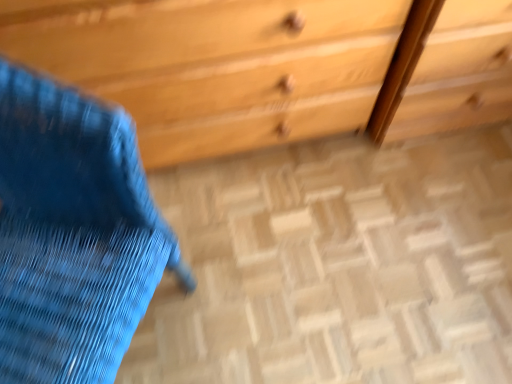
Question: Choose the correct answer: Is wooden chest of drawers at upper center inside wooden floor at center or outside it?

Choices:
 (A) outside
 (B) inside

Answer: (A)

Question: In terms of size, does wooden chest of drawers at upper center appear bigger or smaller than wooden floor at center?

Choices:
 (A) big
 (B) small

Answer: (A)

Question: Estimate the real-world distances between objects in this image. Which object is closer to the blue fabric swivel chair at left?

Choices:
 (A) wooden floor at center
 (B) wooden chest of drawers at upper center

Answer: (B)

Question: Which of these objects is positioned closest to the wooden chest of drawers at upper center?

Choices:
 (A) blue fabric swivel chair at left
 (B) wooden floor at center

Answer: (B)